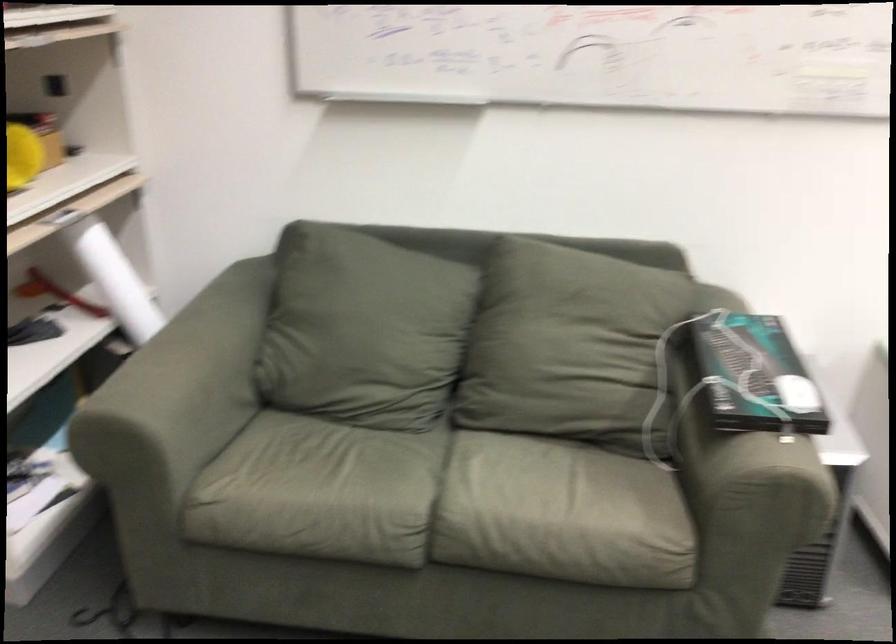
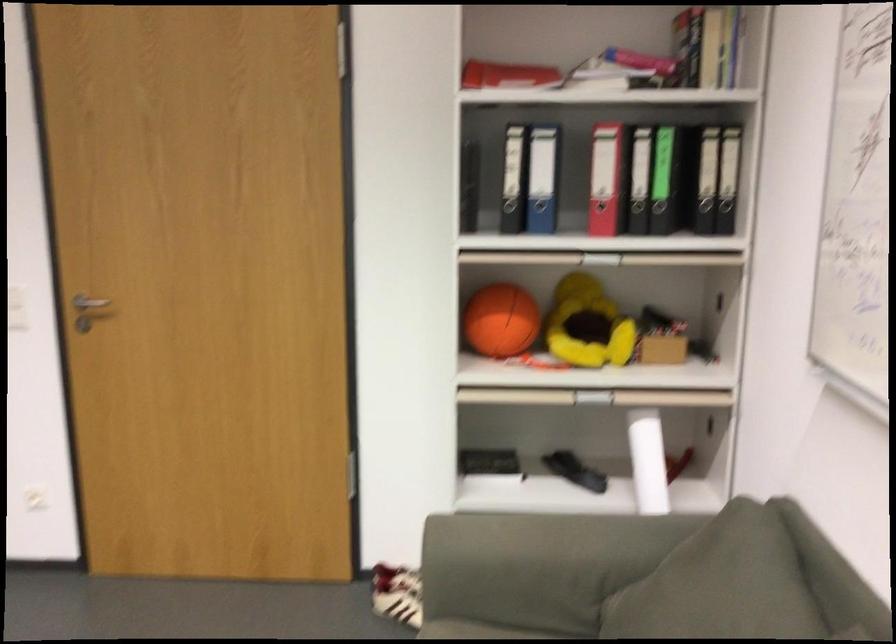
The point at [390,278] is marked in the first image. Where is the corresponding point in the second image?

(747, 592)